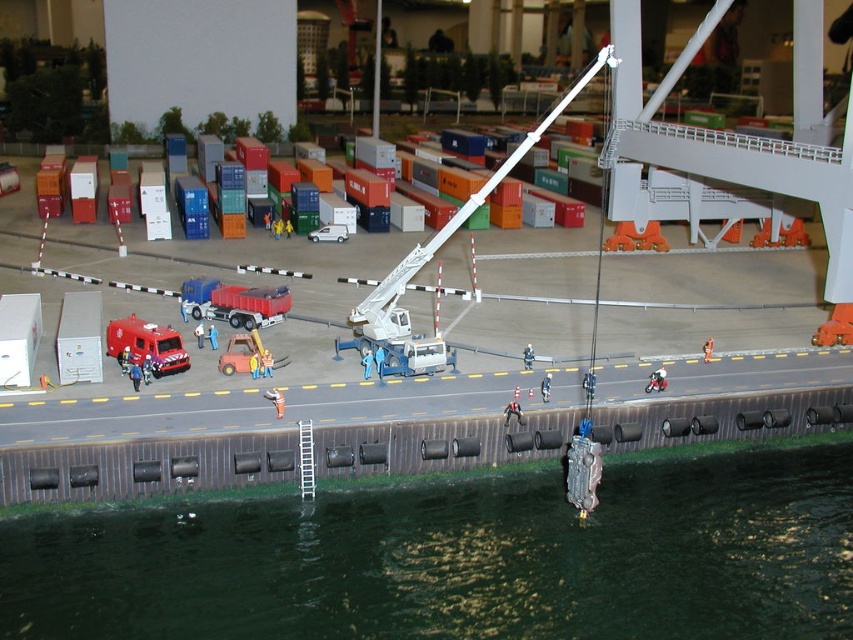
Question: Where is matte red truck at center located in relation to metallic silver motorcycle at center in the image?

Choices:
 (A) above
 (B) below

Answer: (A)

Question: Which of the following is the closest to the observer?

Choices:
 (A) (228, 372)
 (B) (650, 372)
 (C) (706, 349)
 (D) (548, 385)

Answer: (D)

Question: Which of the following is the closest to the observer?

Choices:
 (A) orange fabric toy at center
 (B) matte red truck at center
 (C) orange matte lifebuoy at center

Answer: (A)

Question: Is green matte water at lower center smaller than orange rubber boat at center?

Choices:
 (A) no
 (B) yes

Answer: (A)

Question: Can you confirm if orange rubber boat at center is positioned to the left of metallic silver crane at center?

Choices:
 (A) yes
 (B) no

Answer: (B)

Question: Considering the real-world distances, which object is closest to the metallic silver motorcycle at center?

Choices:
 (A) matte red truck at center
 (B) green matte water at lower center

Answer: (B)